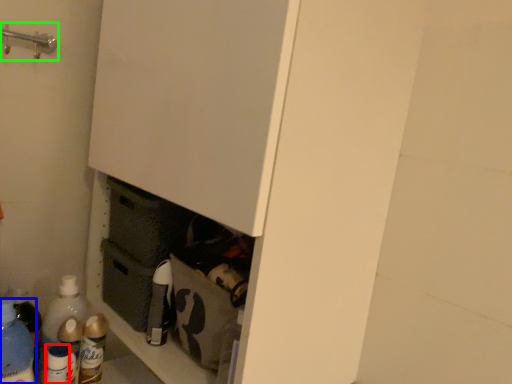
Question: Based on their relative distances, which object is farther from bottle (highlighted by a red box)? Choose from bottle (highlighted by a blue box) and door handle (highlighted by a green box).

Choices:
 (A) bottle
 (B) door handle

Answer: (B)